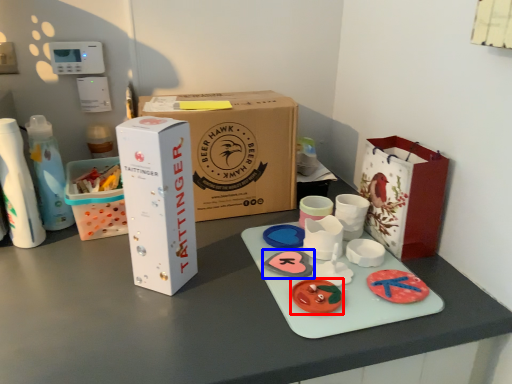
Question: Which point is closer to the camera, toy (highlighted by a red box) or toy (highlighted by a blue box)?

Choices:
 (A) toy
 (B) toy

Answer: (A)